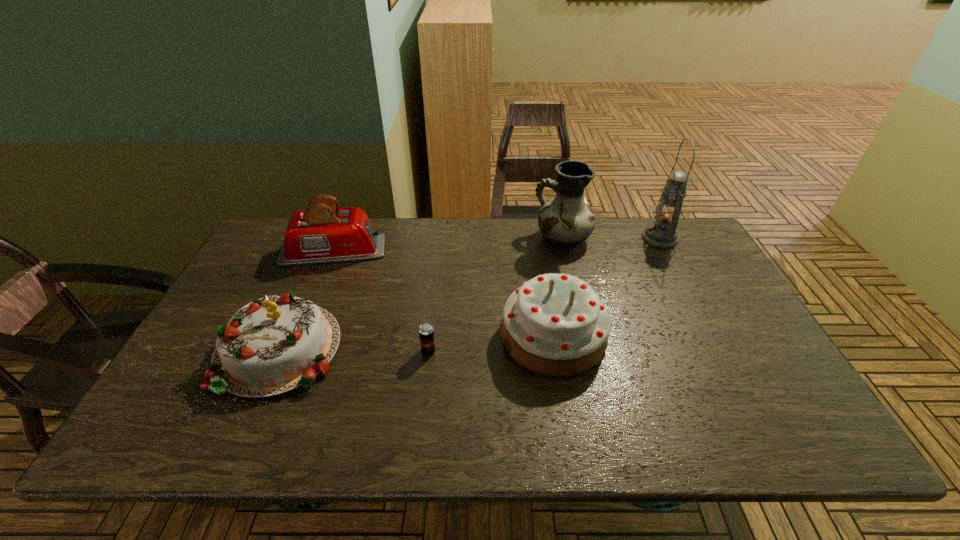
Locate an element on the screen. The width and height of the screenshot is (960, 540). oil lamp is located at coordinates (662, 233).

At what (x,y) coordinates should I click in order to perform the action: click on the rightmost object. Please return your answer as a coordinate pair (x, y). Image resolution: width=960 pixels, height=540 pixels. Looking at the image, I should click on (662, 233).

At what (x,y) coordinates should I click in order to perform the action: click on vase. Please return your answer as a coordinate pair (x, y). This screenshot has height=540, width=960. Looking at the image, I should click on (566, 221).

This screenshot has height=540, width=960. In order to click on toaster in this screenshot , I will do `click(324, 233)`.

I want to click on the right cake, so click(555, 325).

You are a GUI agent. You are given a task and a screenshot of the screen. Output one action in this format:
    pyautogui.click(x=<x>, y=<y>)
    Task: Click on the left cake
    This screenshot has width=960, height=540.
    Given the screenshot: What is the action you would take?
    pyautogui.click(x=275, y=344)

Locate an element on the screen. beer can is located at coordinates (426, 331).

You are a GUI agent. You are given a task and a screenshot of the screen. Output one action in this format:
    pyautogui.click(x=<x>, y=<y>)
    Task: Click on the third object from left to right
    
    Given the screenshot: What is the action you would take?
    pyautogui.click(x=426, y=331)

Find the location of a particular element. vacant space located on the front of the oil lamp is located at coordinates (689, 294).

This screenshot has width=960, height=540. Find the location of `free region located 0.130m on the front of the fifth shortest object`. free region located 0.130m on the front of the fifth shortest object is located at coordinates point(573,282).